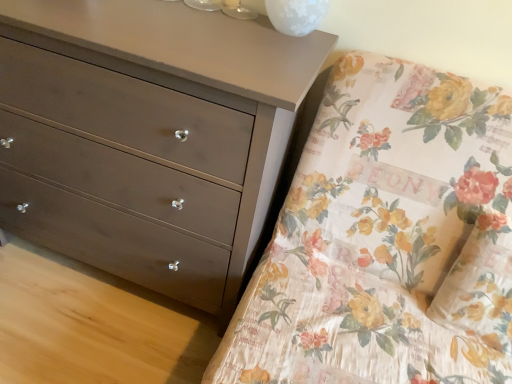
Identify the location of vacant space situated on the left part of white frosted glass at upper center. (234, 17).